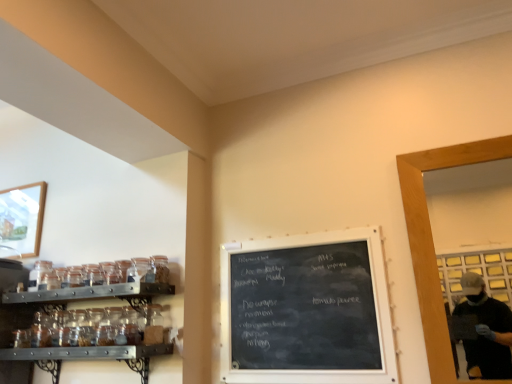
Question: Can you confirm if wooden frame at right is smaller than transparent glass jar at upper left, positioned as the 1th glass jar in right-to-left order?

Choices:
 (A) no
 (B) yes

Answer: (A)

Question: Does wooden frame at right have a greater width compared to transparent glass jar at upper left, positioned as the 1th glass jar in right-to-left order?

Choices:
 (A) yes
 (B) no

Answer: (B)

Question: From the image's perspective, is wooden frame at right beneath transparent glass jar at upper left, positioned as the 1th glass jar in right-to-left order?

Choices:
 (A) no
 (B) yes

Answer: (A)

Question: Can you confirm if wooden frame at right is positioned to the right of transparent glass jar at upper left, acting as the 2th glass jar starting from the left?

Choices:
 (A) yes
 (B) no

Answer: (A)

Question: Is wooden frame at right next to transparent glass jar at upper left, acting as the 2th glass jar starting from the left, and touching it?

Choices:
 (A) yes
 (B) no

Answer: (B)

Question: From a real-world perspective, is wooden frame at right below transparent glass jar at upper left, which ranks as the first glass jar in front-to-back order?

Choices:
 (A) no
 (B) yes

Answer: (B)

Question: Considering the relative positions of wooden framed picture at upper left and wooden frame at right in the image provided, is wooden framed picture at upper left behind wooden frame at right?

Choices:
 (A) no
 (B) yes

Answer: (B)

Question: Is wooden framed picture at upper left turned away from wooden frame at right?

Choices:
 (A) yes
 (B) no

Answer: (B)

Question: Considering the relative sizes of wooden framed picture at upper left and wooden frame at right in the image provided, is wooden framed picture at upper left taller than wooden frame at right?

Choices:
 (A) no
 (B) yes

Answer: (A)

Question: Is wooden framed picture at upper left outside wooden frame at right?

Choices:
 (A) yes
 (B) no

Answer: (A)

Question: From a real-world perspective, is wooden framed picture at upper left physically above wooden frame at right?

Choices:
 (A) no
 (B) yes

Answer: (B)

Question: Is wooden framed picture at upper left positioned before wooden frame at right?

Choices:
 (A) no
 (B) yes

Answer: (A)

Question: Considering the relative positions of wooden framed picture at upper left and clear glass jar at left, which is the second glass jar in front-to-back order, in the image provided, is wooden framed picture at upper left to the left of clear glass jar at left, which is the second glass jar in front-to-back order, from the viewer's perspective?

Choices:
 (A) yes
 (B) no

Answer: (A)